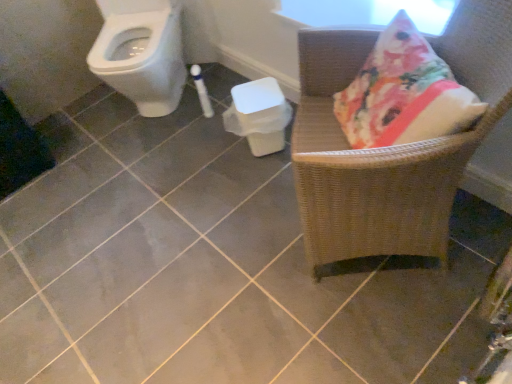
Identify the location of white plastic potty at center. This screenshot has width=512, height=384. (259, 115).

Measure the distance between white plastic potty at center and camera.

white plastic potty at center and camera are 1.73 meters apart.

This screenshot has height=384, width=512. In order to click on woven wood chair at right in this screenshot , I will do `click(390, 147)`.

Which point is more distant from viewer, [139,29] or [315,243]?

The point [139,29] is behind.

In the image, is white glossy toilet at upper left positioned in front of or behind woven wood chair at right?

In the image, white glossy toilet at upper left appears behind woven wood chair at right.

Would you consider white glossy toilet at upper left to be distant from woven wood chair at right?

white glossy toilet at upper left is far away from woven wood chair at right.

Is woven wood chair at right at the back of white glossy toilet at upper left?

No, woven wood chair at right is not at the back of white glossy toilet at upper left.

Does white glossy toilet at upper left turn towards white plastic potty at center?

No, white glossy toilet at upper left is not oriented towards white plastic potty at center.

Which object is positioned more to the right, white glossy toilet at upper left or white plastic potty at center?

white plastic potty at center is more to the right.

Can white plastic potty at center be found inside white glossy toilet at upper left?

No, white plastic potty at center is not a part of white glossy toilet at upper left.

Is white glossy toilet at upper left positioned behind white plastic potty at center?

No, white glossy toilet at upper left is in front of white plastic potty at center.

From a real-world perspective, is woven wood chair at right on white plastic potty at center?

Yes.

Could you tell me if woven wood chair at right is turned towards white plastic potty at center?

No, woven wood chair at right does not turn towards white plastic potty at center.

Which is in front, woven wood chair at right or white plastic potty at center?

Positioned in front is woven wood chair at right.

Is woven wood chair at right taller than white plastic potty at center?

Indeed, woven wood chair at right has a greater height compared to white plastic potty at center.

From the picture: Is white plastic potty at center looking in the opposite direction of woven wood chair at right?

No, white plastic potty at center's orientation is not away from woven wood chair at right.

From a real-world perspective, between white plastic potty at center and woven wood chair at right, who is vertically lower?

In real-world perspective, white plastic potty at center is lower.

Which object is more forward, white plastic potty at center or woven wood chair at right?

Positioned in front is woven wood chair at right.

From the picture: Is woven wood chair at right oriented away from white glossy toilet at upper left?

No, woven wood chair at right is not facing the opposite direction of white glossy toilet at upper left.

From a real-world perspective, is woven wood chair at right on white glossy toilet at upper left?

Yes, from a real-world perspective, woven wood chair at right is on top of white glossy toilet at upper left.

From the image's perspective, between woven wood chair at right and white glossy toilet at upper left, who is located below?

woven wood chair at right, from the image's perspective.

Identify the location of toilet on the left of the woven wood chair at right. The width and height of the screenshot is (512, 384). (141, 53).

Is white plastic potty at center not within white glossy toilet at upper left?

white plastic potty at center is positioned outside white glossy toilet at upper left.

From a real-world perspective, which object rests below the other?

In real-world perspective, white plastic potty at center is lower.

Is white plastic potty at center aimed at white glossy toilet at upper left?

No, white plastic potty at center is not turned towards white glossy toilet at upper left.

Looking at this image, is white plastic potty at center wider or thinner than white glossy toilet at upper left?

Clearly, white plastic potty at center has less width compared to white glossy toilet at upper left.

Where is `toilet below the woven wood chair at right (from a real-world perspective)`? This screenshot has width=512, height=384. toilet below the woven wood chair at right (from a real-world perspective) is located at coordinates (141, 53).

I want to click on toilet on the left of white plastic potty at center, so click(x=141, y=53).

Based on the photo, based on their spatial positions, is woven wood chair at right or white plastic potty at center closer to white glossy toilet at upper left?

The object closer to white glossy toilet at upper left is white plastic potty at center.

From the image, which object appears to be farther from white glossy toilet at upper left, white plastic potty at center or woven wood chair at right?

woven wood chair at right.

Looking at the image, which one is located further to woven wood chair at right, white glossy toilet at upper left or white plastic potty at center?

Among the two, white glossy toilet at upper left is located further to woven wood chair at right.

When comparing their distances from white plastic potty at center, does white glossy toilet at upper left or woven wood chair at right seem further?

white glossy toilet at upper left.

Which object lies nearer to the anchor point white plastic potty at center, woven wood chair at right or white glossy toilet at upper left?

The object closer to white plastic potty at center is woven wood chair at right.

Estimate the real-world distances between objects in this image. Which object is further from woven wood chair at right, white plastic potty at center or white glossy toilet at upper left?

white glossy toilet at upper left is positioned further to the anchor woven wood chair at right.

At what (x,y) coordinates should I click in order to perform the action: click on toilet positioned between woven wood chair at right and white plastic potty at center from near to far. Please return your answer as a coordinate pair (x, y). Image resolution: width=512 pixels, height=384 pixels. Looking at the image, I should click on (141, 53).